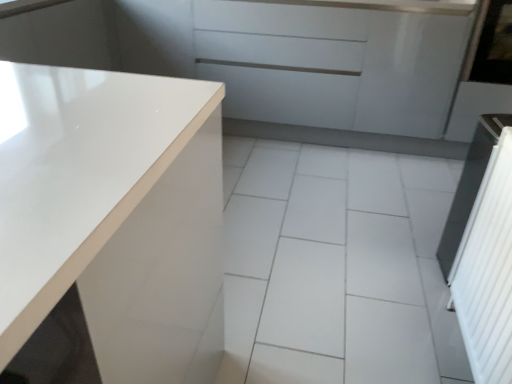
This screenshot has width=512, height=384. Identify the location of free space to the left of white textured screen door at right, the 2th screen door when ordered from top to bottom. (370, 347).